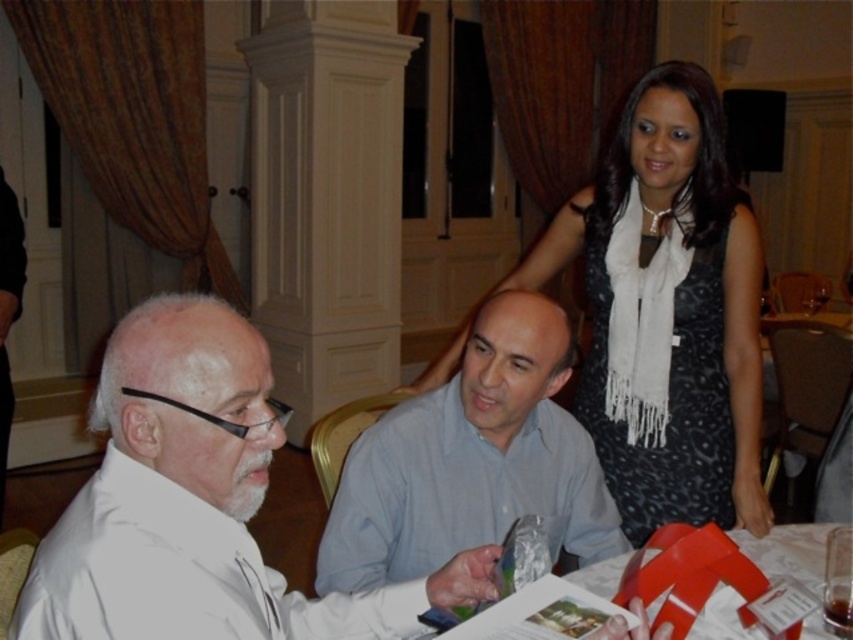
You are standing at the entrance of the room and want to move towards the point at coordinates point (273, 442) and point (828, 634). Which point should you reach first?

You should reach point (273, 442) first because it is in front of point (828, 634), meaning it is closer to your starting position at the entrance.